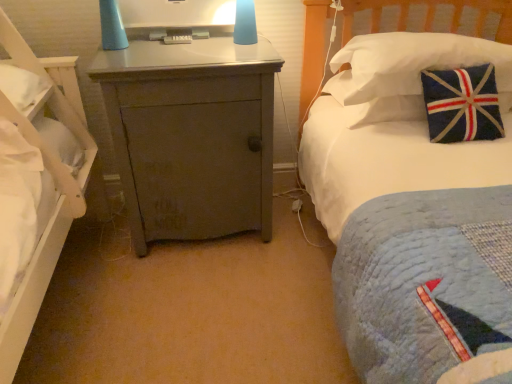
Question: Would you consider matte gray cabinet at center to be distant from matte plastic monitor at center?

Choices:
 (A) no
 (B) yes

Answer: (A)

Question: Does matte gray cabinet at center appear on the left side of matte plastic monitor at center?

Choices:
 (A) yes
 (B) no

Answer: (B)

Question: Is matte gray cabinet at center not inside matte plastic monitor at center?

Choices:
 (A) yes
 (B) no

Answer: (A)

Question: From a real-world perspective, is matte gray cabinet at center positioned under matte plastic monitor at center based on gravity?

Choices:
 (A) yes
 (B) no

Answer: (A)

Question: Does matte gray cabinet at center appear on the right side of matte plastic monitor at center?

Choices:
 (A) yes
 (B) no

Answer: (A)

Question: In terms of size, does matte gray cabinet at center appear bigger or smaller than white fabric pillow at upper right?

Choices:
 (A) big
 (B) small

Answer: (A)

Question: Considering the positions of matte gray cabinet at center and white fabric pillow at upper right in the image, is matte gray cabinet at center wider or thinner than white fabric pillow at upper right?

Choices:
 (A) thin
 (B) wide

Answer: (B)

Question: In the image, is matte gray cabinet at center positioned in front of or behind white fabric pillow at upper right?

Choices:
 (A) front
 (B) behind

Answer: (A)

Question: Considering the relative positions of matte gray cabinet at center and white fabric pillow at upper right in the image provided, is matte gray cabinet at center to the left or to the right of white fabric pillow at upper right?

Choices:
 (A) left
 (B) right

Answer: (A)

Question: From the image's perspective, relative to matte gray cabinet at center, is white fabric pillow at upper right above or below?

Choices:
 (A) below
 (B) above

Answer: (B)

Question: Would you say white fabric pillow at upper right is to the left or to the right of matte gray cabinet at center in the picture?

Choices:
 (A) left
 (B) right

Answer: (B)

Question: In terms of size, does white fabric pillow at upper right appear bigger or smaller than matte gray cabinet at center?

Choices:
 (A) small
 (B) big

Answer: (A)

Question: Is point (339, 86) positioned closer to the camera than point (224, 226)?

Choices:
 (A) farther
 (B) closer

Answer: (A)

Question: In terms of height, does white fabric pillow at upper right look taller or shorter compared to matte plastic monitor at center?

Choices:
 (A) tall
 (B) short

Answer: (A)

Question: Considering their positions, is white fabric pillow at upper right located in front of or behind matte plastic monitor at center?

Choices:
 (A) behind
 (B) front

Answer: (B)